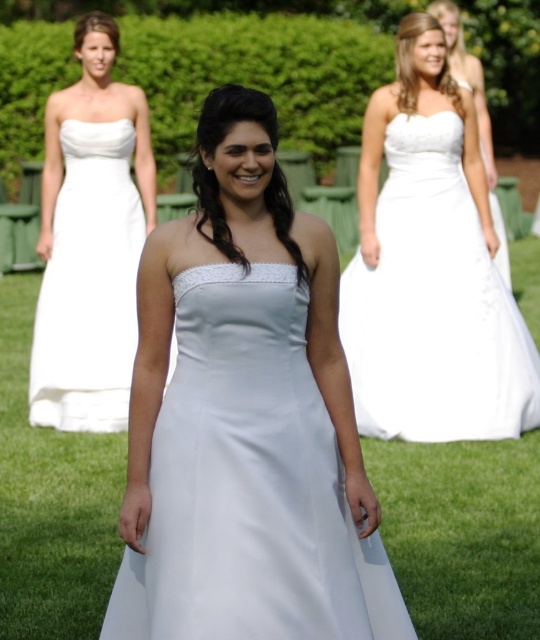
Is white satin dress at upper center smaller than white satin dress at center?

Incorrect, white satin dress at upper center is not smaller in size than white satin dress at center.

Measure the distance between point (428, 404) and camera.

8.42 meters

Find the location of a particular element. white satin dress at upper center is located at coordinates (430, 268).

Is point (238, 326) closer to viewer compared to point (490, 200)?

Yes, point (238, 326) is closer to viewer.

How distant is satin white dress at center from white satin dress at center?

8.79 meters

Between point (181, 513) and point (446, 32), which one is positioned in front?

Point (181, 513) is more forward.

The image size is (540, 640). Find the location of `satin white dress at center`. satin white dress at center is located at coordinates (248, 484).

Is white satin dress at upper center to the right of white satin dress at upper left from the viewer's perspective?

Correct, you'll find white satin dress at upper center to the right of white satin dress at upper left.

Which of these two, white satin dress at upper center or white satin dress at upper left, stands taller?

white satin dress at upper left

Find the location of `white satin dress at upper center`. white satin dress at upper center is located at coordinates (430, 268).